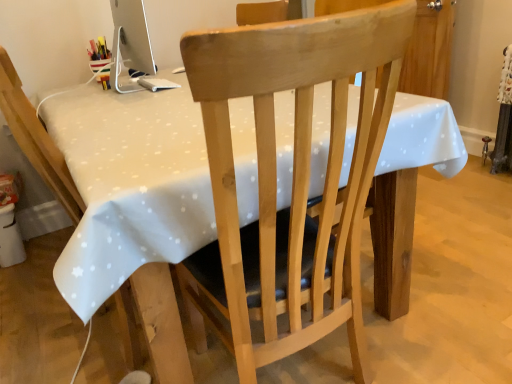
Question: Which direction should I rotate to look at natural wood chair at center, which is the 2th chair in left-to-right order?

Choices:
 (A) right
 (B) left

Answer: (A)

Question: Is natural wood chair at center, the first chair from the right, at the right side of light wood chair at center, which is the 1th chair from left to right?

Choices:
 (A) no
 (B) yes

Answer: (B)

Question: Is natural wood chair at center, which is the 2th chair in left-to-right order, taller than light wood chair at center, the 2th chair positioned from the right?

Choices:
 (A) no
 (B) yes

Answer: (B)

Question: Is the surface of natural wood chair at center, the first chair from the right, in direct contact with light wood chair at center, which is the 1th chair from left to right?

Choices:
 (A) yes
 (B) no

Answer: (B)

Question: From a real-world perspective, is natural wood chair at center, the first chair from the right, located beneath light wood chair at center, the 2th chair positioned from the right?

Choices:
 (A) no
 (B) yes

Answer: (A)

Question: Is natural wood chair at center, the first chair from the right, behind light wood chair at center, which is the 1th chair from left to right?

Choices:
 (A) no
 (B) yes

Answer: (A)

Question: Can you confirm if natural wood chair at center, the first chair from the right, is shorter than light wood chair at center, which is the 1th chair from left to right?

Choices:
 (A) yes
 (B) no

Answer: (B)

Question: Can you confirm if light wood chair at center, the 2th chair positioned from the right, is shorter than natural wood chair at center, the first chair from the right?

Choices:
 (A) yes
 (B) no

Answer: (A)

Question: Is light wood chair at center, the 2th chair positioned from the right, to the right of natural wood chair at center, which is the 2th chair in left-to-right order, from the viewer's perspective?

Choices:
 (A) yes
 (B) no

Answer: (B)

Question: Is natural wood chair at center, the first chair from the right, located within light wood chair at center, which is the 1th chair from left to right?

Choices:
 (A) no
 (B) yes

Answer: (A)

Question: Does light wood chair at center, which is the 1th chair from left to right, appear on the left side of natural wood chair at center, which is the 2th chair in left-to-right order?

Choices:
 (A) no
 (B) yes

Answer: (B)

Question: From a real-world perspective, is light wood chair at center, the 2th chair positioned from the right, positioned over natural wood chair at center, the first chair from the right, based on gravity?

Choices:
 (A) no
 (B) yes

Answer: (A)

Question: Is light wood chair at center, the 2th chair positioned from the right, facing towards natural wood chair at center, the first chair from the right?

Choices:
 (A) no
 (B) yes

Answer: (A)

Question: Is white glossy computer monitor at upper left looking in the opposite direction of white dotted tablecloth at center?

Choices:
 (A) yes
 (B) no

Answer: (B)